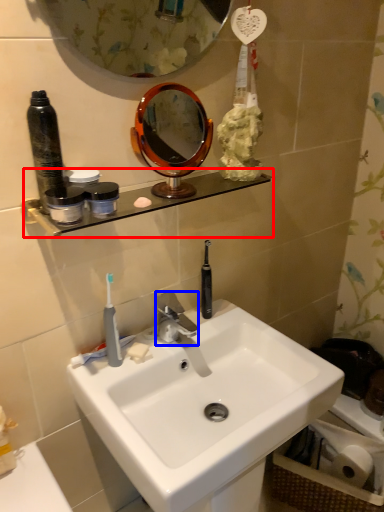
Question: Which object appears farthest to the camera in this image, shelve (highlighted by a red box) or faucet (highlighted by a blue box)?

Choices:
 (A) shelve
 (B) faucet

Answer: (B)